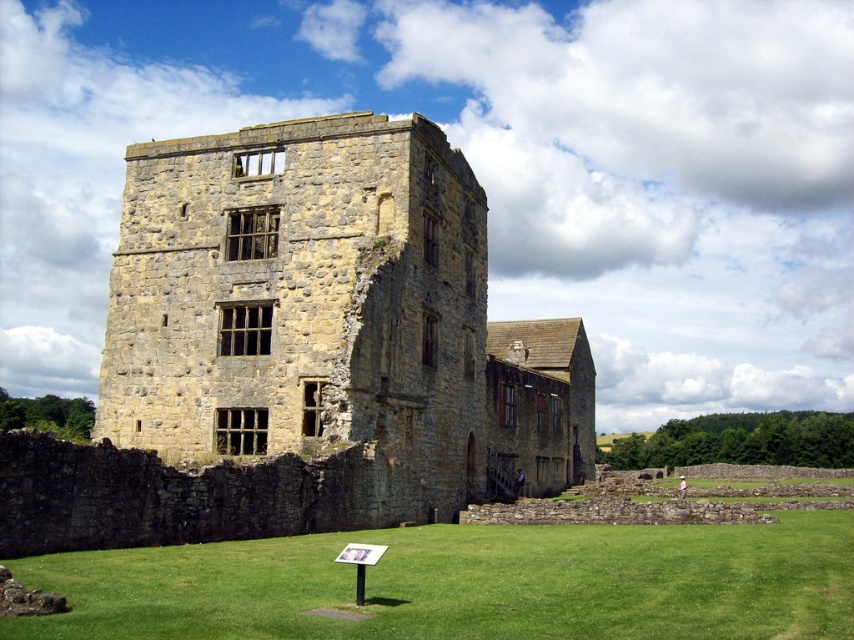
Can you confirm if yellow stone tower at center is thinner than green grass at lower center?

In fact, yellow stone tower at center might be wider than green grass at lower center.

Describe the element at coordinates (301, 349) in the screenshot. I see `yellow stone tower at center` at that location.

Describe the element at coordinates (301, 349) in the screenshot. I see `yellow stone tower at center` at that location.

Where is `yellow stone tower at center`? This screenshot has width=854, height=640. yellow stone tower at center is located at coordinates (301, 349).